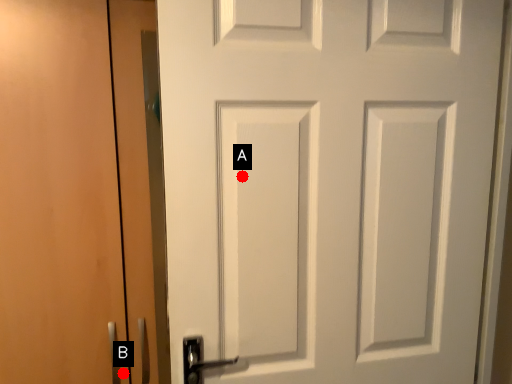
Question: Two points are circled on the image, labeled by A and B beside each circle. Which point is farther to the camera?

Choices:
 (A) A is further
 (B) B is further

Answer: (B)